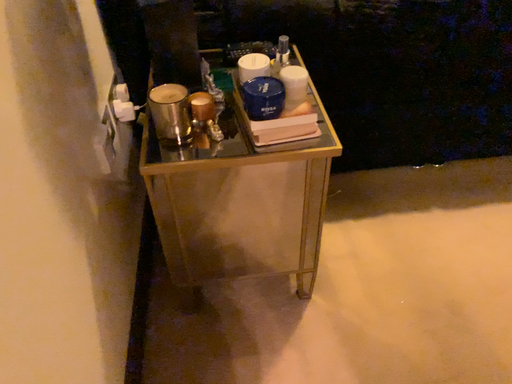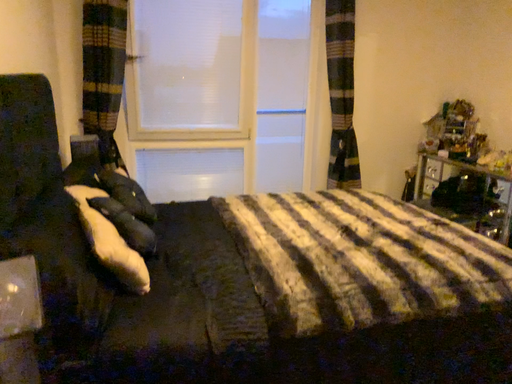
Question: Which way did the camera rotate in the video?

Choices:
 (A) rotated right
 (B) rotated left

Answer: (A)